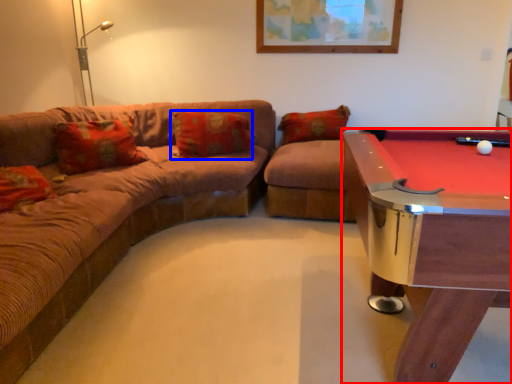
Question: Which object appears farthest to the camera in this image, billiard table (highlighted by a red box) or pillow (highlighted by a blue box)?

Choices:
 (A) billiard table
 (B) pillow

Answer: (B)